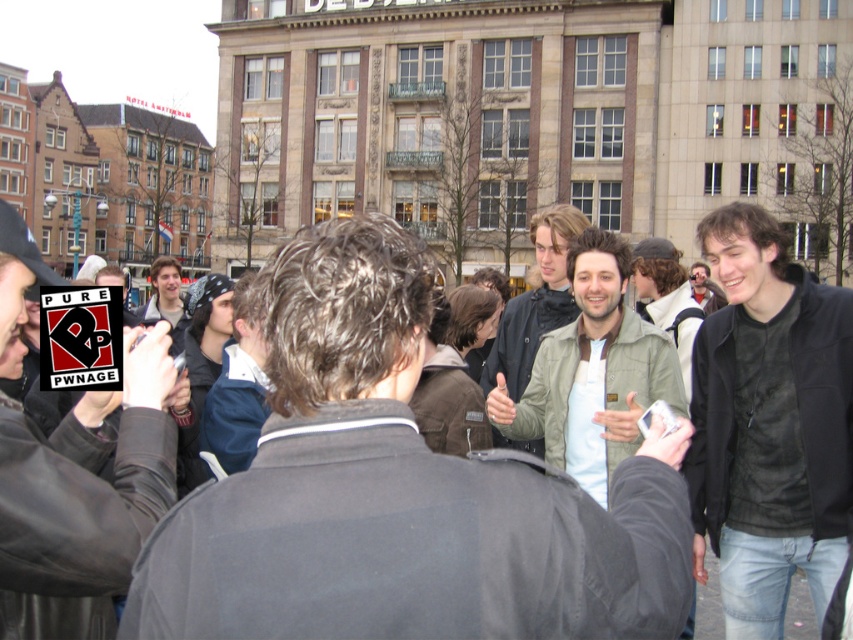
Describe the element at coordinates (398, 492) in the screenshot. I see `green fabric jacket at center` at that location.

Between green fabric jacket at center and black leather jacket at center, which one has less height?

green fabric jacket at center

Locate an element on the screen. This screenshot has width=853, height=640. green fabric jacket at center is located at coordinates tap(398, 492).

Can you confirm if green fabric jacket at center is smaller than olive-green jacket at center?

No, green fabric jacket at center is not smaller than olive-green jacket at center.

Who is more distant from viewer, (505,499) or (621,276)?

The point (621,276) is more distant.

Locate an element on the screen. green fabric jacket at center is located at coordinates (398, 492).

Can you confirm if black leather jacket at center is smaller than olive-green jacket at center?

Indeed, black leather jacket at center has a smaller size compared to olive-green jacket at center.

Between point (712, 228) and point (601, 460), which one is positioned in front?

Point (601, 460)

This screenshot has width=853, height=640. I want to click on black leather jacket at center, so click(x=769, y=422).